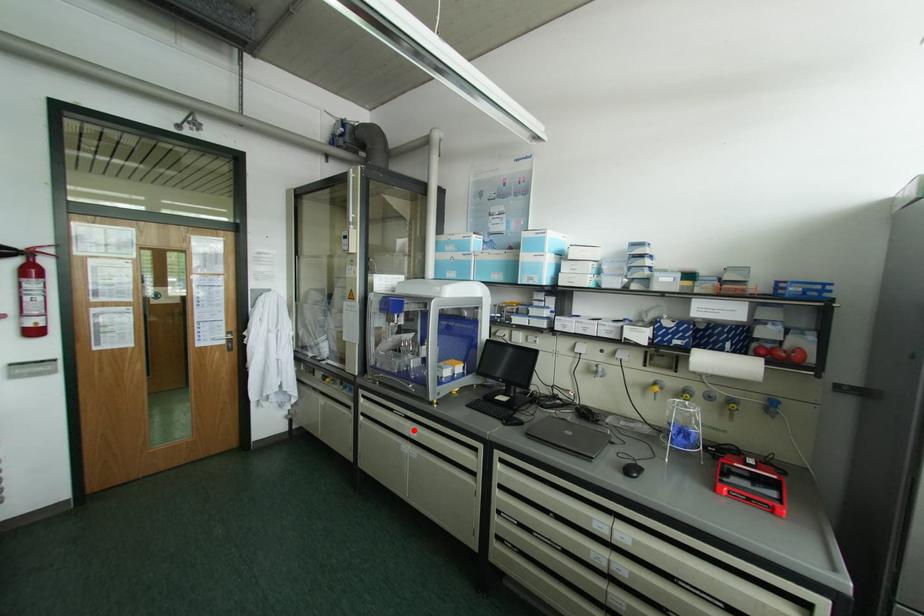
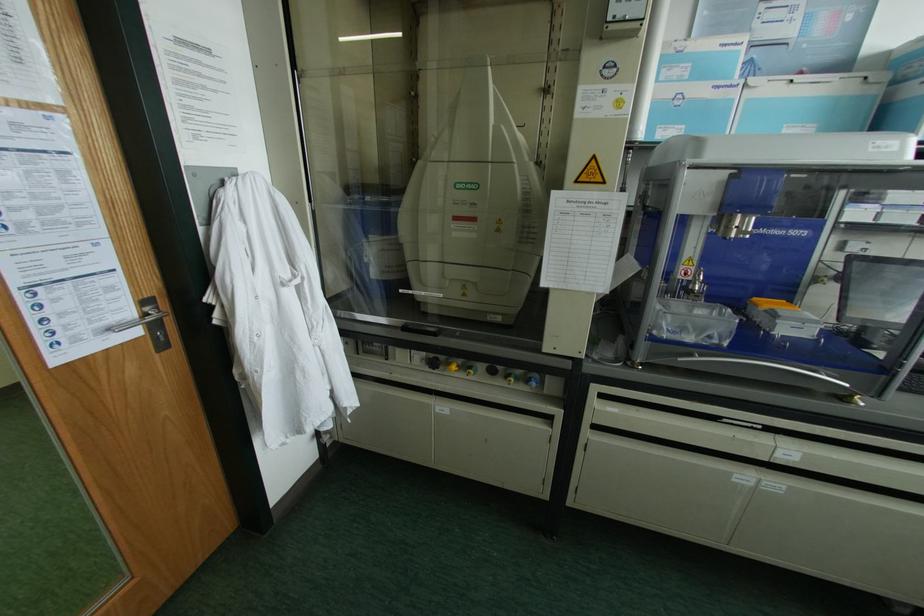
Question: A red point is marked in image1. In image2, is the corresponding 3D point closer to the camera or farther? Reply with the corresponding letter.

Choices:
 (A) The corresponding 3D point is closer.
 (B) The corresponding 3D point is farther.

Answer: (A)